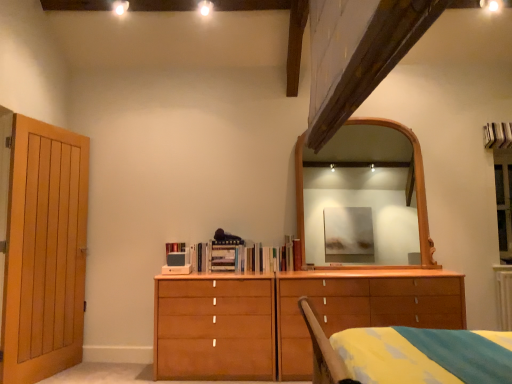
Find the location of a particular element. The image size is (512, 384). free space below light brown wooden door at left (from a real-world perspective) is located at coordinates (54, 369).